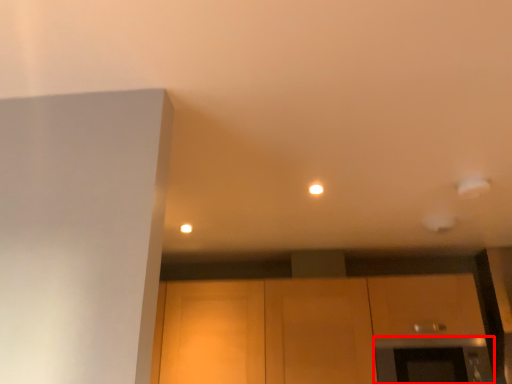
Question: From the image's perspective, where is oven (annotated by the red box) located in relation to cabinetry in the image?

Choices:
 (A) above
 (B) below

Answer: (B)